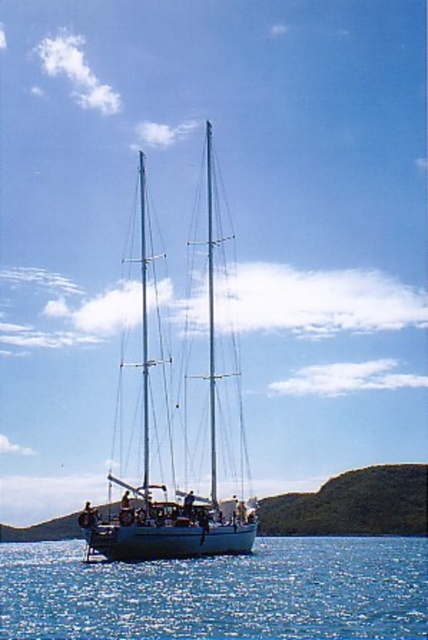
Between blue liquid water at center and white glossy sailboat at center, which one appears on the right side from the viewer's perspective?

blue liquid water at center

Between blue liquid water at center and white glossy sailboat at center, which one appears on the left side from the viewer's perspective?

white glossy sailboat at center is more to the left.

Find the location of `blue liquid water at center`. blue liquid water at center is located at coordinates pos(220,592).